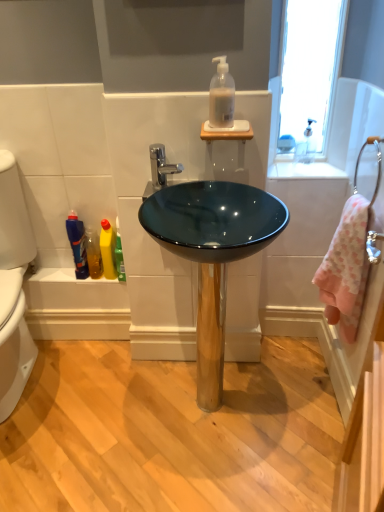
Question: Are translucent plastic soap dispenser at upper center, acting as the first cleaning product starting from the right, and translucent yellow liquid at lower left located far from each other?

Choices:
 (A) yes
 (B) no

Answer: (B)

Question: Can you confirm if translucent plastic soap dispenser at upper center, marked as the second cleaning product in a left-to-right arrangement, is positioned to the left of translucent yellow liquid at lower left?

Choices:
 (A) no
 (B) yes

Answer: (A)

Question: Considering the relative positions of translucent plastic soap dispenser at upper center, arranged as the first cleaning product when viewed from the front, and translucent yellow liquid at lower left in the image provided, is translucent plastic soap dispenser at upper center, arranged as the first cleaning product when viewed from the front, behind translucent yellow liquid at lower left?

Choices:
 (A) no
 (B) yes

Answer: (A)

Question: Is translucent yellow liquid at lower left completely or partially inside translucent plastic soap dispenser at upper center, the 2th cleaning product in the bottom-to-top sequence?

Choices:
 (A) no
 (B) yes

Answer: (A)

Question: Is translucent plastic soap dispenser at upper center, acting as the first cleaning product starting from the right, located outside translucent yellow liquid at lower left?

Choices:
 (A) yes
 (B) no

Answer: (A)

Question: Could you tell me if translucent plastic soap dispenser at upper center, the 2th cleaning product in the bottom-to-top sequence, is turned towards translucent yellow liquid at lower left?

Choices:
 (A) no
 (B) yes

Answer: (A)

Question: Does yellow plastic bottle at lower left, which is counted as the second cleaning product, starting from the top, come behind glossy glass bowl at center?

Choices:
 (A) yes
 (B) no

Answer: (A)

Question: Considering the relative sizes of yellow plastic bottle at lower left, which ranks as the second cleaning product in front-to-back order, and glossy glass bowl at center in the image provided, is yellow plastic bottle at lower left, which ranks as the second cleaning product in front-to-back order, shorter than glossy glass bowl at center?

Choices:
 (A) no
 (B) yes

Answer: (B)

Question: From the image's perspective, is yellow plastic bottle at lower left, the 2th cleaning product from the right, on glossy glass bowl at center?

Choices:
 (A) yes
 (B) no

Answer: (A)

Question: Is yellow plastic bottle at lower left, which ranks as the second cleaning product in front-to-back order, far away from glossy glass bowl at center?

Choices:
 (A) no
 (B) yes

Answer: (A)

Question: From a real-world perspective, does yellow plastic bottle at lower left, which is the first cleaning product from back to front, sit lower than glossy glass bowl at center?

Choices:
 (A) yes
 (B) no

Answer: (B)

Question: Is yellow plastic bottle at lower left, which is the first cleaning product from back to front, oriented away from glossy glass bowl at center?

Choices:
 (A) yes
 (B) no

Answer: (B)

Question: Does translucent yellow liquid at lower left have a lesser height compared to pink terry cloth towel at right?

Choices:
 (A) no
 (B) yes

Answer: (B)